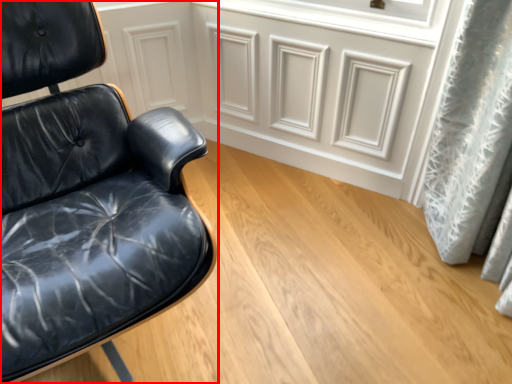
Question: From the image, what is the correct spatial relationship of chair (annotated by the red box) in relation to drawer?

Choices:
 (A) right
 (B) left

Answer: (B)